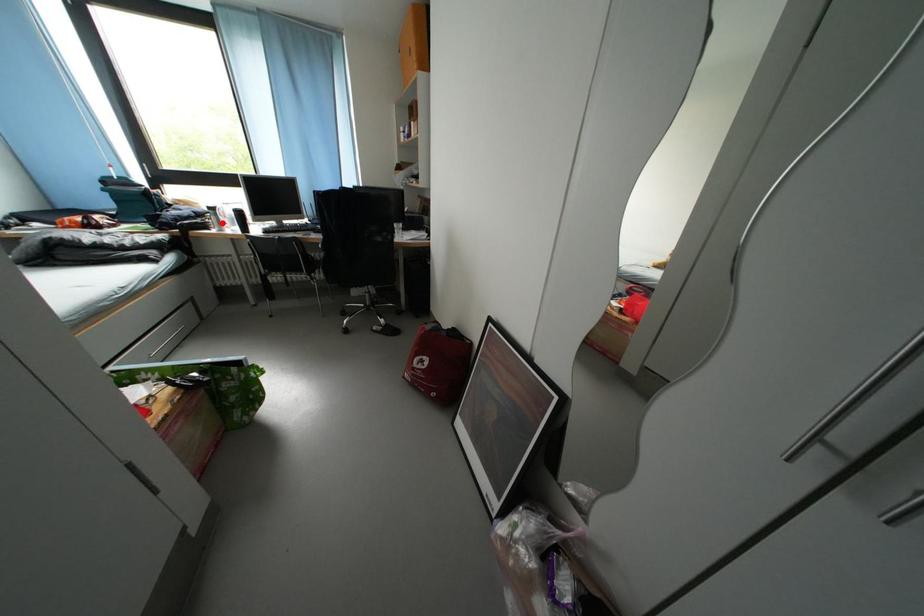
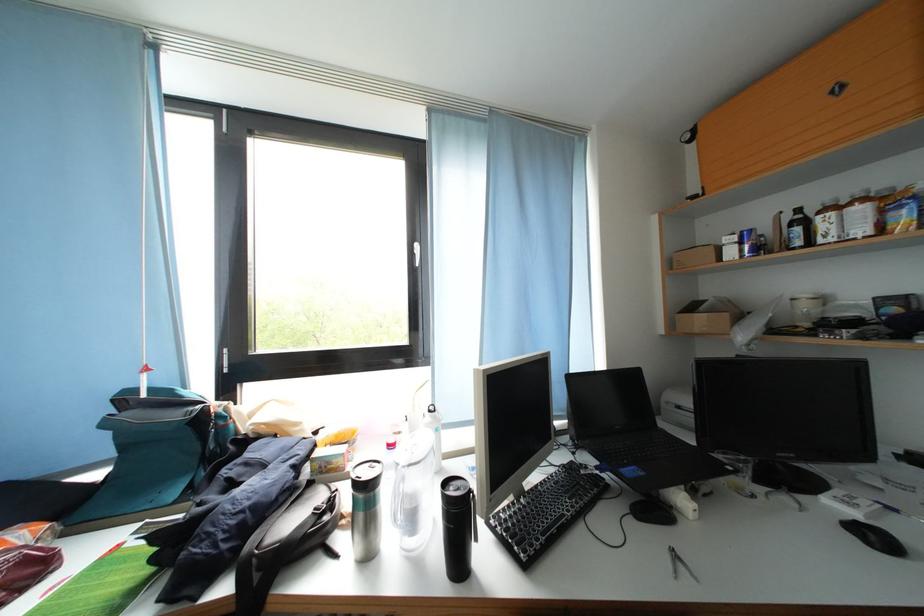
In the second image, find the point that corresponds to the highlighted location in the first image.

(369, 521)